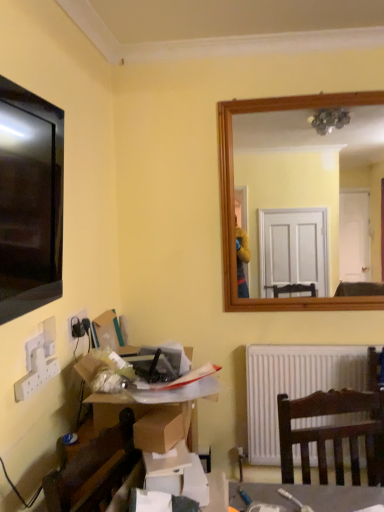
What is the approximate width of black plastic socket at lower left?

black plastic socket at lower left is 0.73 inches in width.

The width and height of the screenshot is (384, 512). What are the coordinates of `white matte radiator at lower center` in the screenshot? It's located at (293, 386).

Measure the distance between cardboard box at lower left and camera.

A distance of 4.23 feet exists between cardboard box at lower left and camera.

Where is `black plastic socket at lower left`? The width and height of the screenshot is (384, 512). black plastic socket at lower left is located at coordinates (75, 322).

From a real-world perspective, which object rests below the other?

From a 3D spatial view, white matte radiator at lower center is below.

Considering the relative sizes of black plastic socket at lower left and white matte radiator at lower center in the image provided, is black plastic socket at lower left thinner than white matte radiator at lower center?

Yes, black plastic socket at lower left is thinner than white matte radiator at lower center.

Can you confirm if black plastic socket at lower left is smaller than white matte radiator at lower center?

Correct, black plastic socket at lower left occupies less space than white matte radiator at lower center.

This screenshot has width=384, height=512. There is a white matte radiator at lower center. Find the location of `electric outlet above it (from a real-world perspective)`. electric outlet above it (from a real-world perspective) is located at coordinates (75, 322).

This screenshot has width=384, height=512. What are the coordinates of `desk in front of the white matte radiator at lower center` in the screenshot? It's located at (154, 407).

From the image's perspective, is white matte radiator at lower center above or below cardboard box at lower left?

Based on their image positions, white matte radiator at lower center is located beneath cardboard box at lower left.

Which object is positioned more to the left, white matte radiator at lower center or cardboard box at lower left?

Positioned to the left is cardboard box at lower left.

Is white matte radiator at lower center thinner than cardboard box at lower left?

Correct, the width of white matte radiator at lower center is less than that of cardboard box at lower left.

Is white matte radiator at lower center looking in the opposite direction of black plastic socket at lower left?

No, black plastic socket at lower left is not at the back of white matte radiator at lower center.

Is white matte radiator at lower center located outside black plastic socket at lower left?

Yes, white matte radiator at lower center is not within black plastic socket at lower left.

From the image's perspective, which object appears higher, white matte radiator at lower center or black plastic socket at lower left?

From the image's view, black plastic socket at lower left is above.

Measure the distance from white matte radiator at lower center to black plastic socket at lower left.

white matte radiator at lower center is 3.46 feet away from black plastic socket at lower left.

From the image's perspective, which one is positioned lower, cardboard box at lower left or white matte radiator at lower center?

From the image's view, white matte radiator at lower center is below.

Considering the points (213, 391) and (295, 361), which point is behind, point (213, 391) or point (295, 361)?

The point (295, 361) is farther.

Considering their positions, is cardboard box at lower left located in front of or behind white matte radiator at lower center?

cardboard box at lower left is in front of white matte radiator at lower center.

Between black plastic socket at lower left and cardboard box at lower left, which one has larger size?

With larger size is cardboard box at lower left.

Looking at this image, is black plastic socket at lower left beside cardboard box at lower left?

There is a gap between black plastic socket at lower left and cardboard box at lower left.

Can you confirm if black plastic socket at lower left is positioned to the right of cardboard box at lower left?

In fact, black plastic socket at lower left is to the left of cardboard box at lower left.

Is black plastic socket at lower left in front of cardboard box at lower left?

No, black plastic socket at lower left is further to the viewer.

Based on the photo, is cardboard box at lower left situated inside black plastic socket at lower left or outside?

The correct answer is: outside.

Does cardboard box at lower left come in front of black plastic socket at lower left?

Yes, it is.

Which is behind, point (196, 439) or point (74, 317)?

The point (196, 439) is farther from the camera.

You are a GUI agent. You are given a task and a screenshot of the screen. Output one action in this format:
    pyautogui.click(x=<x>, y=<y>)
    Task: Click on the electric outlet that is above the white matte radiator at lower center (from a real-world perspective)
    The image size is (384, 512).
    Given the screenshot: What is the action you would take?
    pyautogui.click(x=75, y=322)

Locate an element on the screen. radiator located underneath the cardboard box at lower left (from a real-world perspective) is located at coordinates (293, 386).

When comparing their distances from black plastic socket at lower left, does white matte radiator at lower center or cardboard box at lower left seem further?

white matte radiator at lower center is further to black plastic socket at lower left.

Estimate the real-world distances between objects in this image. Which object is closer to white matte radiator at lower center, cardboard box at lower left or black plastic socket at lower left?

The object closer to white matte radiator at lower center is cardboard box at lower left.

From the image, which object appears to be farther from white matte radiator at lower center, black plastic socket at lower left or cardboard box at lower left?

black plastic socket at lower left is further to white matte radiator at lower center.

Looking at the image, which one is located closer to cardboard box at lower left, black plastic socket at lower left or white matte radiator at lower center?

Based on the image, black plastic socket at lower left appears to be nearer to cardboard box at lower left.

Based on their spatial positions, is white matte radiator at lower center or black plastic socket at lower left closer to cardboard box at lower left?

Among the two, black plastic socket at lower left is located nearer to cardboard box at lower left.

Which object lies further to the anchor point black plastic socket at lower left, cardboard box at lower left or white matte radiator at lower center?

The object further to black plastic socket at lower left is white matte radiator at lower center.

Locate an element on the screen. Image resolution: width=384 pixels, height=512 pixels. desk between black plastic socket at lower left and white matte radiator at lower center from left to right is located at coordinates (154, 407).